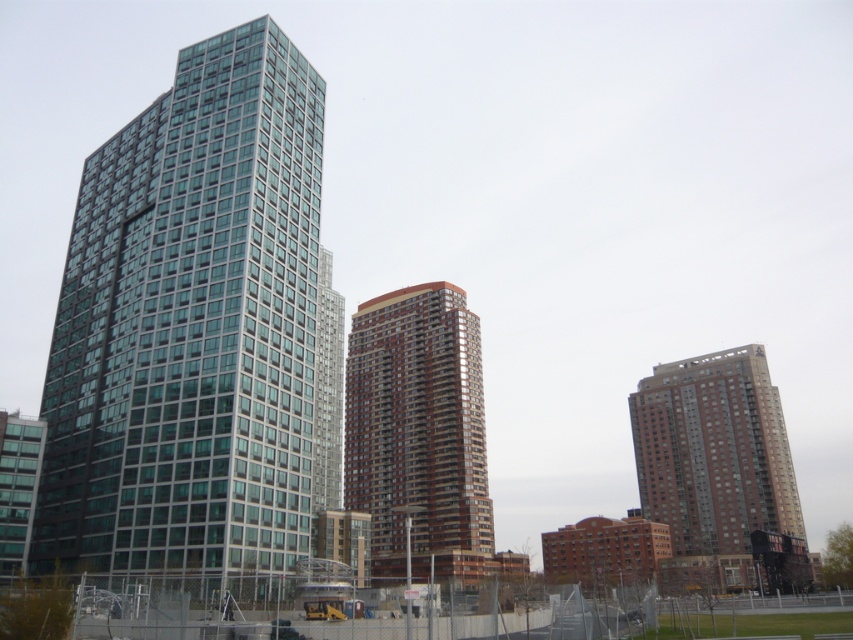
You are standing in the city and want to take a photo of both the brown glassy building at center and the brown glassy building at right. Which building should you focus on first to ensure both are in frame?

You should focus on the brown glassy building at center first since it is closer to you than the brown glassy building at right, allowing both to be captured in the frame.

You are an architect analyzing the cityscape. You notice two brown glassy buildings labeled as the brown glassy building at center and the brown glassy building at right. Based on their positions, which one appears closer to the observer?

The brown glassy building at center is positioned over the brown glassy building at right, indicating that it is closer to the observer.

You are an architect analyzing a cityscape. You have two points of interest marked on the image. The first is the glassy teal skyscraper at left, represented by point A at coordinates [190,324]. The second is the traditional brick building to the right, represented by point B at coordinates 0.687, 0.351. Which point is closer to the top edge of the image?

Point A at coordinates [190,324] is closer to the top edge of the image because its y coordinate is lower, indicating a higher position on the image plane.